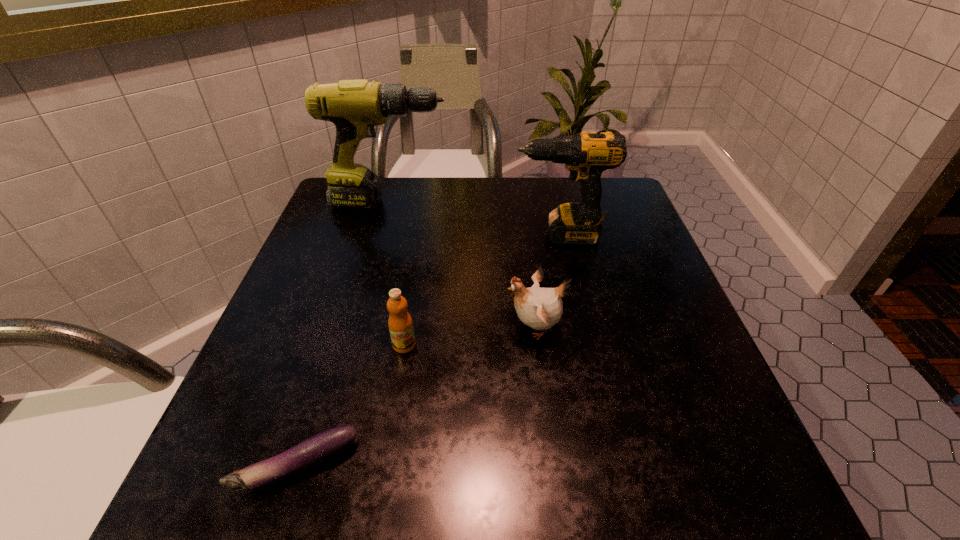
The height and width of the screenshot is (540, 960). In order to click on object situated at the right edge in this screenshot , I will do `click(586, 155)`.

Where is `object located in the far left corner section of the desktop`? This screenshot has height=540, width=960. object located in the far left corner section of the desktop is located at coordinates (355, 107).

Identify the location of object at the near left corner. This screenshot has width=960, height=540. (321, 447).

In order to click on object present at the far right corner in this screenshot , I will do `click(586, 155)`.

You are a GUI agent. You are given a task and a screenshot of the screen. Output one action in this format:
    pyautogui.click(x=<x>, y=<y>)
    Task: Click on the vacant space at the far edge of the desktop
    The height and width of the screenshot is (540, 960).
    Given the screenshot: What is the action you would take?
    pyautogui.click(x=524, y=179)

Where is `free location at the near edge of the desktop`? free location at the near edge of the desktop is located at coordinates (448, 494).

In the image, there is a desktop. Find the location of `free space at the left edge`. free space at the left edge is located at coordinates (330, 243).

Find the location of a particular element. vacant space at the right edge of the desktop is located at coordinates (650, 354).

In the image, there is a desktop. Identify the location of vacant space at the far right corner. The image size is (960, 540). (603, 227).

Find the location of `empty space that is in between the orange juice and the bird`. empty space that is in between the orange juice and the bird is located at coordinates (469, 336).